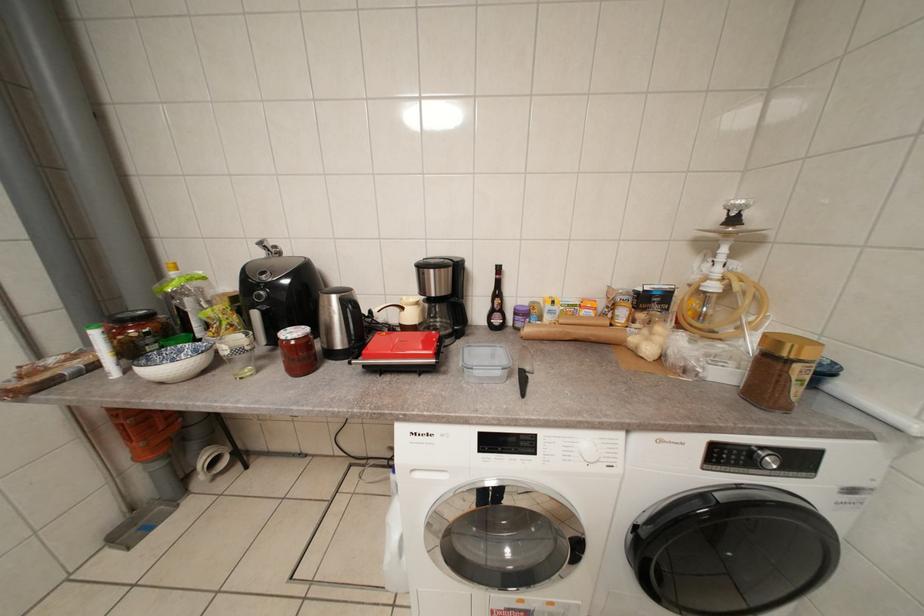
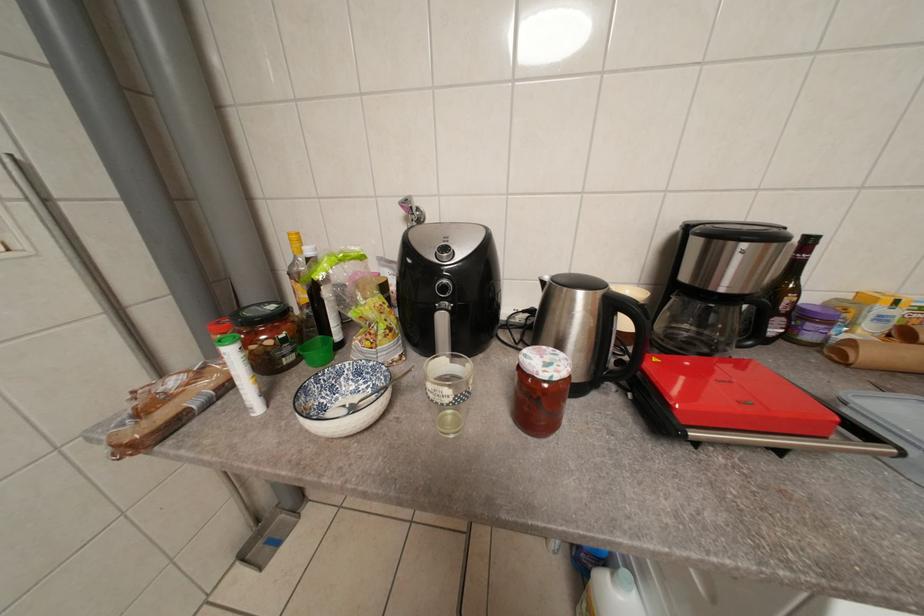
What movement of the cameraman would produce the second image?

The cameraman walked toward left, forward.